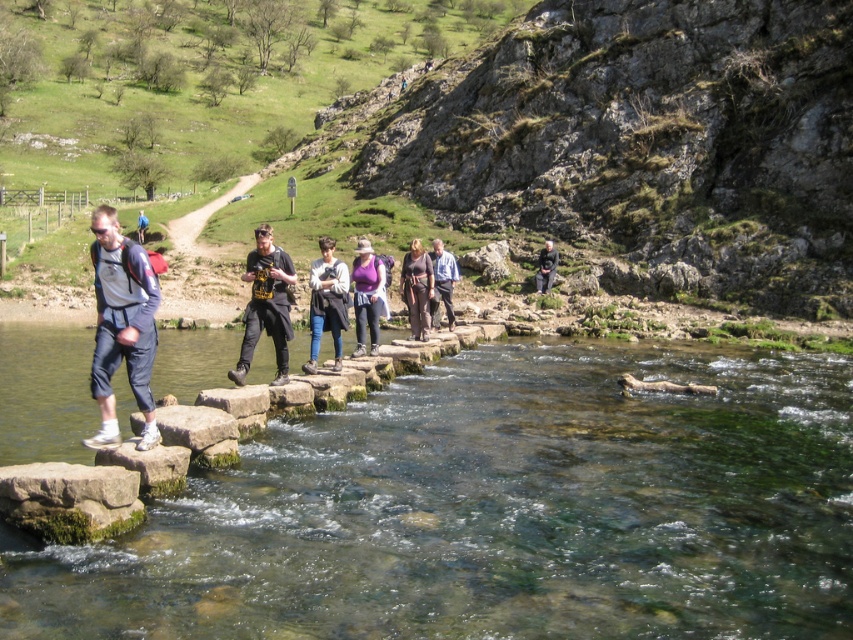
Does point (376, 262) come behind point (410, 308)?

No, (376, 262) is closer to viewer.

Is the position of purple fabric at center more distant than that of brown fabric pants at center?

No, purple fabric at center is in front of brown fabric pants at center.

Between point (355, 288) and point (426, 269), which one is positioned in front?

Point (355, 288) is in front.

Identify the location of purple fabric at center. The width and height of the screenshot is (853, 640). (366, 296).

Is dark gray fabric jacket at center thinner than purple fabric at center?

In fact, dark gray fabric jacket at center might be wider than purple fabric at center.

Does dark gray fabric jacket at center have a lesser height compared to purple fabric at center?

No.

Describe the element at coordinates (265, 305) in the screenshot. I see `dark gray fabric jacket at center` at that location.

This screenshot has height=640, width=853. In order to click on dark gray fabric jacket at center in this screenshot , I will do `click(265, 305)`.

Between brown fabric pants at center and matte gray backpack at left, which one is positioned higher?

matte gray backpack at left is above.

What do you see at coordinates (416, 289) in the screenshot?
I see `brown fabric pants at center` at bounding box center [416, 289].

The image size is (853, 640). I want to click on brown fabric pants at center, so click(416, 289).